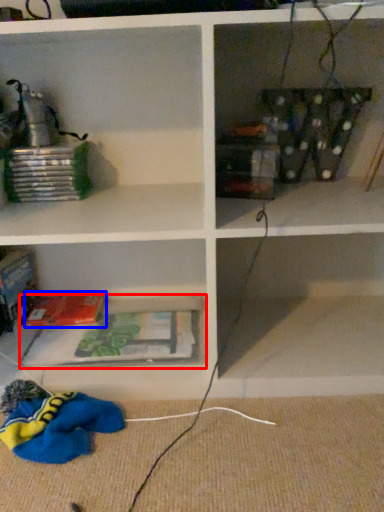
Question: Which object is closer to the camera taking this photo, cabinet (highlighted by a red box) or paperback book (highlighted by a blue box)?

Choices:
 (A) cabinet
 (B) paperback book

Answer: (A)